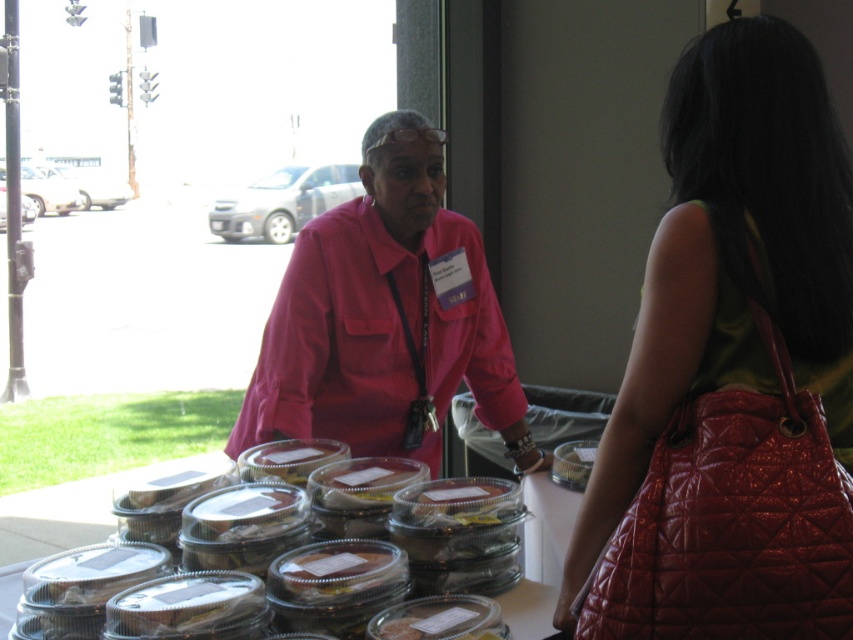
You are standing in front of the table with baked goods and want to reach both points mentioned. Which point, point (723, 397) or point (416, 163), is closer to you?

Point (723, 397) is closer to the viewer than point (416, 163).

You are a customer at this event and want to pick up both the shiny red purse at center and the pink fabric shirt at center. Which item should you reach for first if you want to grab the one closer to you?

The shiny red purse at center is below the pink fabric shirt at center, so it is closer to you. You should reach for the shiny red purse at center first.